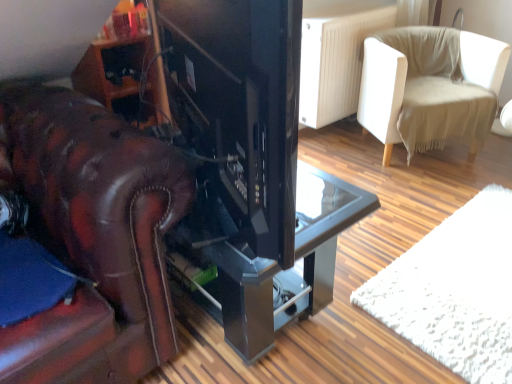
This screenshot has height=384, width=512. I want to click on beige fabric chair at upper right, so click(x=422, y=81).

Where is `beige fabric chair at upper right`? beige fabric chair at upper right is located at coordinates (422, 81).

Can you tell me how much matte black tv at center and beige fabric chair at upper right differ in facing direction?

They differ by 97.2 degrees in their facing directions.

From a real-world perspective, is matte black tv at center on top of beige fabric chair at upper right?

Yes, from a real-world perspective, matte black tv at center is over beige fabric chair at upper right

Can you confirm if matte black tv at center is positioned to the left of beige fabric chair at upper right?

Correct, you'll find matte black tv at center to the left of beige fabric chair at upper right.

Is matte black tv at center closer to the viewer compared to beige fabric chair at upper right?

Yes, matte black tv at center is closer to the viewer.

Consider the image. Which is in front, glossy black table at center or matte black tv at center?

matte black tv at center.

What's the angular difference between glossy black table at center and matte black tv at center's facing directions?

The facing directions of glossy black table at center and matte black tv at center are 20.9 degrees apart.

Looking at this image, is glossy black table at center far from matte black tv at center?

glossy black table at center is near matte black tv at center, not far away.

Between glossy black table at center and matte black tv at center, which one appears on the right side from the viewer's perspective?

Positioned to the right is glossy black table at center.

Can you confirm if beige fabric chair at upper right is thinner than glossy black table at center?

No, beige fabric chair at upper right is not thinner than glossy black table at center.

From a real-world perspective, is beige fabric chair at upper right physically below glossy black table at center?

Actually, beige fabric chair at upper right is physically above glossy black table at center in the real world.

Between point (497, 54) and point (324, 198), which one is positioned in front?

The point (324, 198) is more forward.

Looking at this image, does beige fabric chair at upper right turn towards glossy black table at center?

No, beige fabric chair at upper right is not aimed at glossy black table at center.

Considering the relative sizes of glossy black table at center and beige fabric chair at upper right in the image provided, is glossy black table at center thinner than beige fabric chair at upper right?

Correct, the width of glossy black table at center is less than that of beige fabric chair at upper right.

Is glossy black table at center spatially inside beige fabric chair at upper right, or outside of it?

glossy black table at center cannot be found inside beige fabric chair at upper right.

Locate an element on the screen. The height and width of the screenshot is (384, 512). table below the beige fabric chair at upper right (from the image's perspective) is located at coordinates (263, 258).

How distant is glossy black table at center from beige fabric chair at upper right?

A distance of 4.36 feet exists between glossy black table at center and beige fabric chair at upper right.

From their relative heights in the image, would you say matte black tv at center is taller or shorter than glossy black table at center?

matte black tv at center is taller than glossy black table at center.

Between matte black tv at center and glossy black table at center, which one has larger width?

With larger width is glossy black table at center.

From a real-world perspective, is matte black tv at center physically above glossy black table at center?

Correct, in the physical world, matte black tv at center is higher than glossy black table at center.

From the image's perspective, does matte black tv at center appear lower than glossy black table at center?

Actually, matte black tv at center appears above glossy black table at center in the image.

Is beige fabric chair at upper right far away from matte black tv at center?

Indeed, beige fabric chair at upper right is not near matte black tv at center.

Is beige fabric chair at upper right aimed at matte black tv at center?

No, beige fabric chair at upper right is not facing towards matte black tv at center.

Which object is further away from the camera taking this photo, beige fabric chair at upper right or matte black tv at center?

beige fabric chair at upper right is more distant.

From the picture: From the image's perspective, relative to matte black tv at center, is beige fabric chair at upper right above or below?

Based on their image positions, beige fabric chair at upper right is located above matte black tv at center.

You are a GUI agent. You are given a task and a screenshot of the screen. Output one action in this format:
    pyautogui.click(x=<x>, y=<y>)
    Task: Click on the appliance above the beige fabric chair at upper right (from a real-world perspective)
    
    Given the screenshot: What is the action you would take?
    pyautogui.click(x=240, y=107)

Locate an element on the screen. This screenshot has height=384, width=512. table on the right of the matte black tv at center is located at coordinates tap(263, 258).

Considering their positions, is beige fabric chair at upper right positioned closer to matte black tv at center than glossy black table at center?

Based on the image, glossy black table at center appears to be nearer to matte black tv at center.

Considering their positions, is glossy black table at center positioned further to beige fabric chair at upper right than matte black tv at center?

matte black tv at center lies further to beige fabric chair at upper right than the other object.

Which object lies nearer to the anchor point glossy black table at center, matte black tv at center or beige fabric chair at upper right?

matte black tv at center is closer to glossy black table at center.

Based on their spatial positions, is beige fabric chair at upper right or matte black tv at center closer to glossy black table at center?

matte black tv at center lies closer to glossy black table at center than the other object.

Based on the photo, when comparing their distances from matte black tv at center, does glossy black table at center or beige fabric chair at upper right seem further?

Based on the image, beige fabric chair at upper right appears to be further to matte black tv at center.

Estimate the real-world distances between objects in this image. Which object is further from beige fabric chair at upper right, matte black tv at center or glossy black table at center?

Among the two, matte black tv at center is located further to beige fabric chair at upper right.

Identify the location of table between matte black tv at center and beige fabric chair at upper right from front to back. (263, 258).